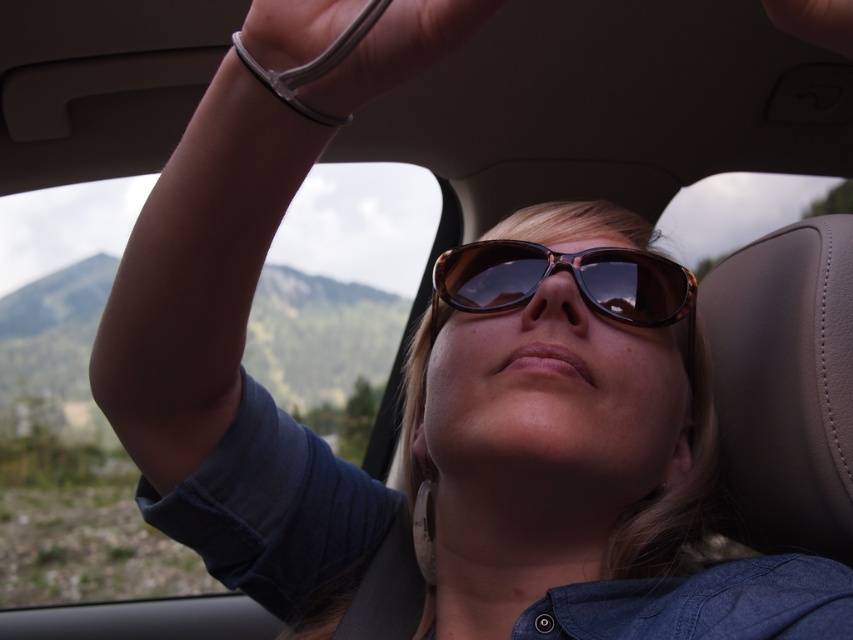
Question: Does tortoiseshell sunglasses at center have a lesser width compared to dark skin at upper center?

Choices:
 (A) no
 (B) yes

Answer: (A)

Question: Which of the following is the closest to the observer?

Choices:
 (A) tortoiseshell sunglasses at center
 (B) clear plastic wristband at upper center
 (C) dark skin at upper center

Answer: (C)

Question: Considering the real-world distances, which object is farthest from the dark skin at upper center?

Choices:
 (A) tortoiseshell sunglasses at center
 (B) clear plastic wristband at upper center

Answer: (A)

Question: Estimate the real-world distances between objects in this image. Which object is closer to the tortoiseshell sunglasses at center?

Choices:
 (A) clear plastic wristband at upper center
 (B) dark skin at upper center

Answer: (A)

Question: Can you confirm if tortoiseshell sunglasses at center is bigger than dark skin at upper center?

Choices:
 (A) yes
 (B) no

Answer: (A)

Question: From the image, what is the correct spatial relationship of clear plastic wristband at upper center in relation to tortoiseshell sunglasses at center?

Choices:
 (A) below
 (B) above

Answer: (B)